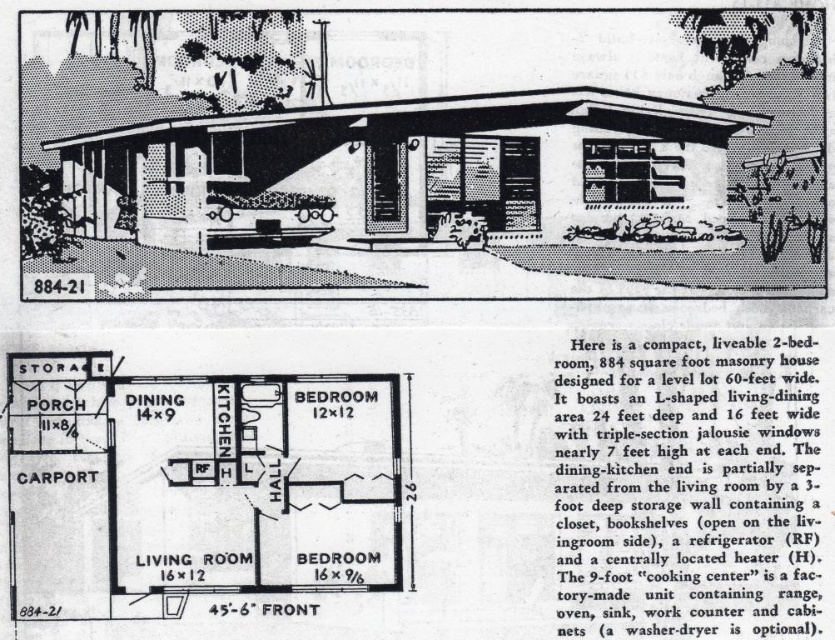
Question: Can you confirm if white textured carport at lower left is positioned above white glossy kitchen at center?

Choices:
 (A) yes
 (B) no

Answer: (A)

Question: Which of the following is the farthest from the observer?

Choices:
 (A) white glossy kitchen at center
 (B) white textured carport at lower left

Answer: (B)

Question: Which of the following is the farthest from the observer?

Choices:
 (A) (390, 516)
 (B) (550, 241)

Answer: (B)

Question: Does white textured carport at lower left appear over white glossy kitchen at center?

Choices:
 (A) no
 (B) yes

Answer: (B)

Question: Is white textured carport at lower left to the left of white glossy kitchen at center from the viewer's perspective?

Choices:
 (A) no
 (B) yes

Answer: (A)